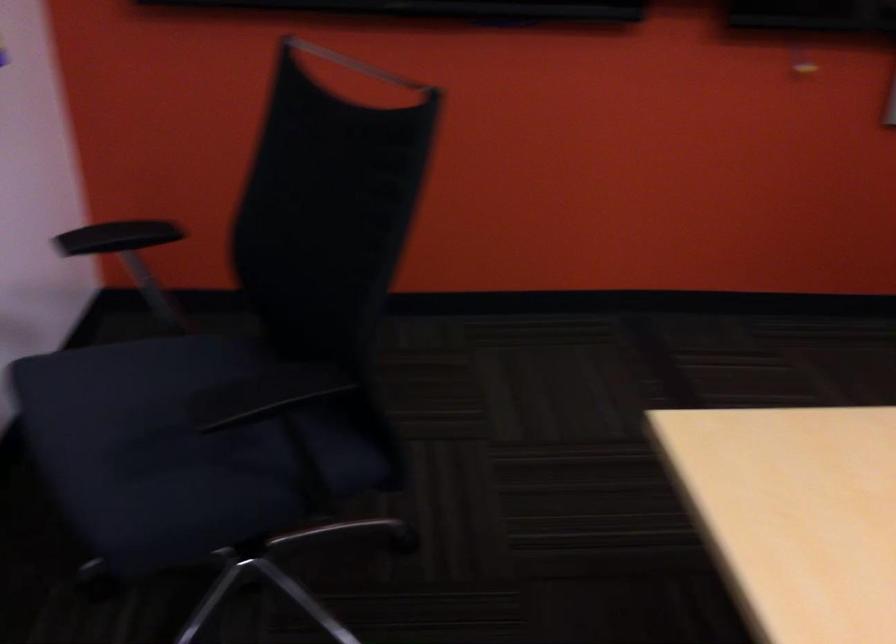
Describe the element at coordinates (356, 64) in the screenshot. This screenshot has height=644, width=896. I see `the chair back handle` at that location.